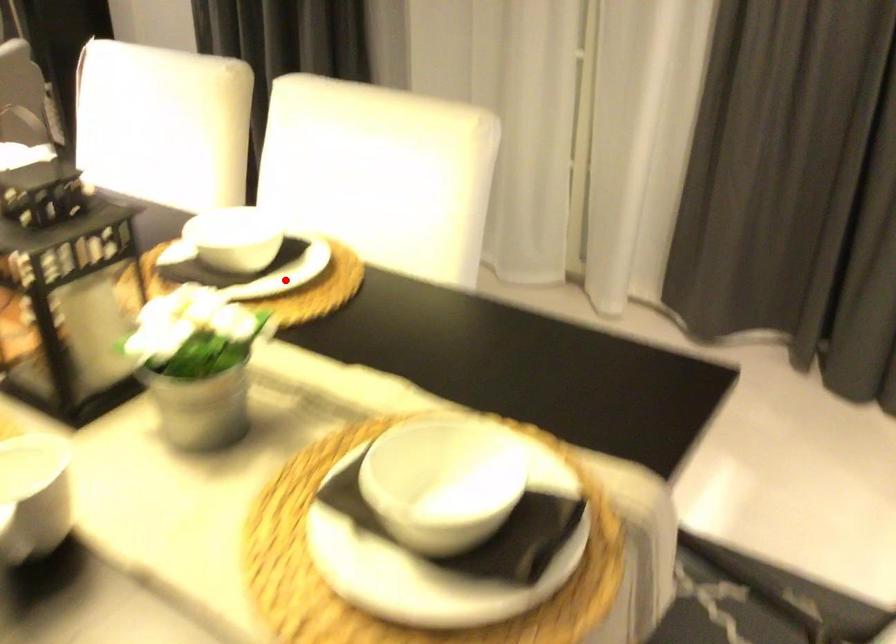
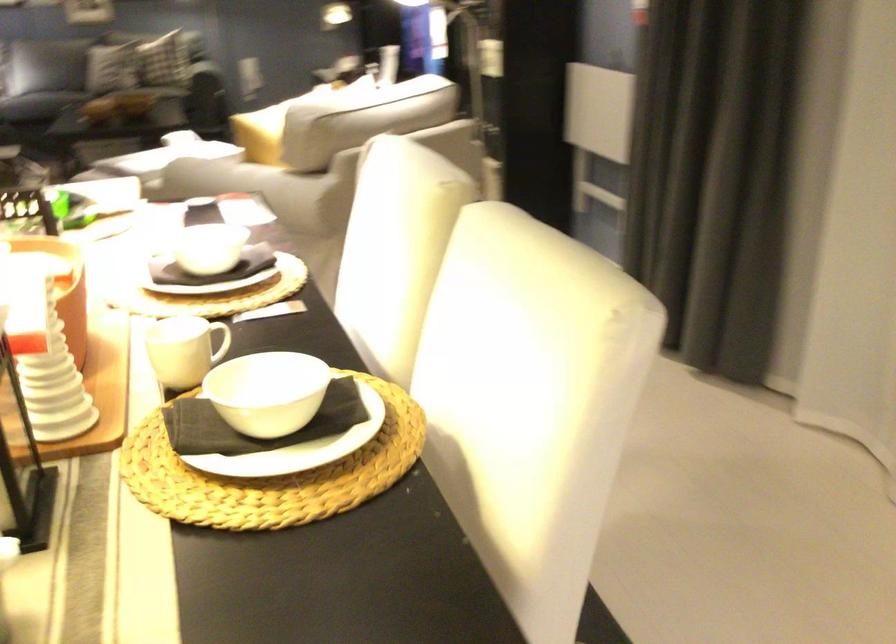
Where in the second image is the point corresponding to the highlighted location from the first image?

(273, 462)